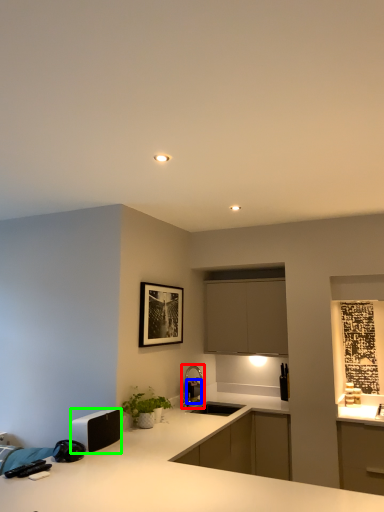
Question: Which is farther away from tap (highlighted by a red box)? appliance (highlighted by a blue box) or appliance (highlighted by a green box)?

Choices:
 (A) appliance
 (B) appliance

Answer: (B)